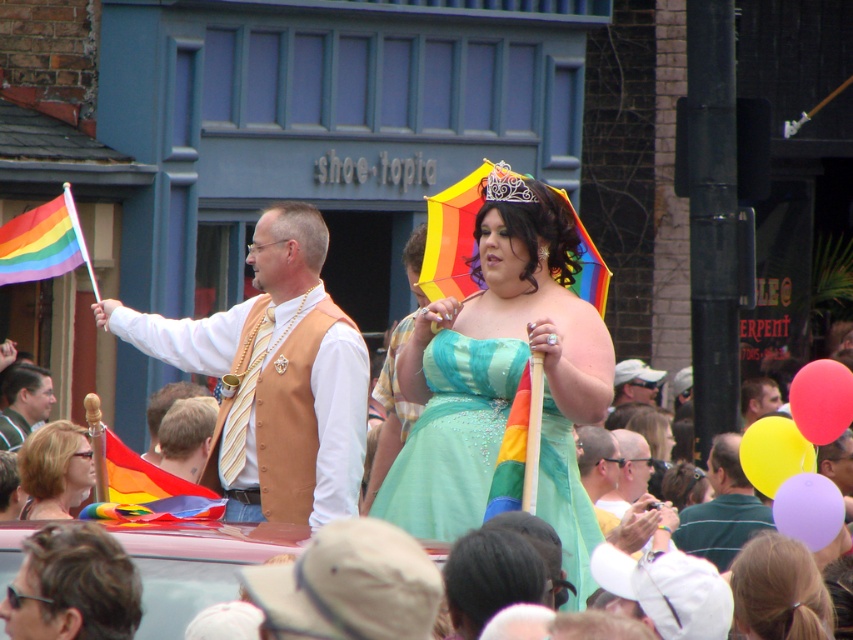
Question: Where is rainbow fabric flag at lower left located in relation to shiny silver tiara at upper center in the image?

Choices:
 (A) below
 (B) above

Answer: (A)

Question: Among these points, which one is nearest to the camera?

Choices:
 (A) (45, 404)
 (B) (758, 634)
 (C) (194, 472)
 (D) (57, 484)

Answer: (B)

Question: Can you confirm if shiny teal dress at center is bigger than green jersey at center?

Choices:
 (A) yes
 (B) no

Answer: (A)

Question: Which of these objects is positioned farthest from the yellow plaid shirt at center?

Choices:
 (A) shiny metallic necklace at upper center
 (B) purple satin dress at lower right
 (C) smooth brown hair at center

Answer: (C)

Question: Which object appears closest to the camera in this image?

Choices:
 (A) rainbow fabric flag at center
 (B) smooth brown vest at center
 (C) rainbow fabric flag at left
 (D) matte black camera at center

Answer: (A)

Question: Does rainbow fabric umbrella at center have a smaller size compared to rainbow fabric flag at left?

Choices:
 (A) no
 (B) yes

Answer: (A)